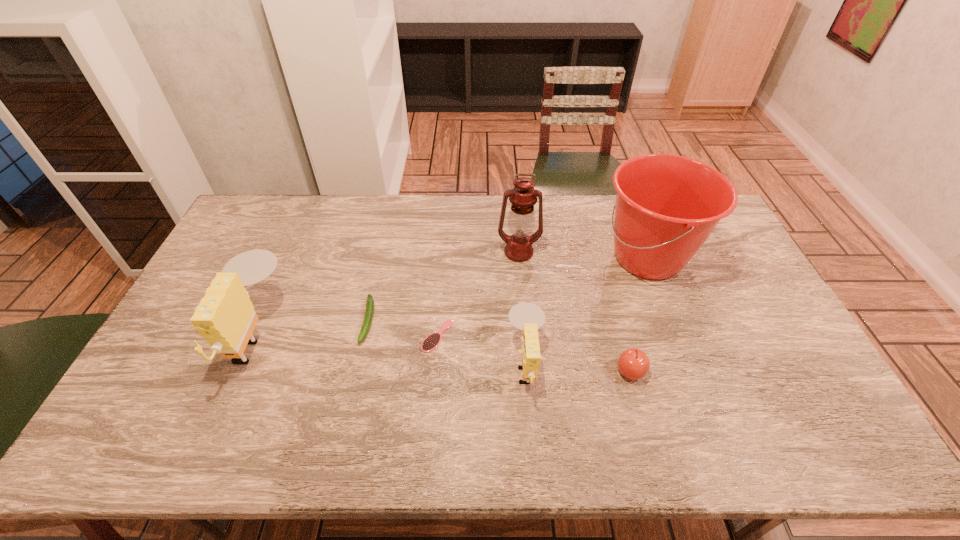
At what (x,y) coordinates should I click in order to perform the action: click on the third shortest object. Please return your answer as a coordinate pair (x, y). Looking at the image, I should click on (634, 364).

Locate an element on the screen. This screenshot has height=540, width=960. free space located on the front-facing side of the leftmost object is located at coordinates (193, 336).

Find the location of a particular element. The height and width of the screenshot is (540, 960). free space located on the front-facing side of the leftmost object is located at coordinates (176, 336).

Locate an element on the screen. Image resolution: width=960 pixels, height=540 pixels. free space located 0.050m on the front-facing side of the leftmost object is located at coordinates (214, 336).

This screenshot has height=540, width=960. I want to click on vacant space situated on the front-facing side of the shorter sponge, so click(x=417, y=364).

The width and height of the screenshot is (960, 540). Find the location of `free region located on the front-facing side of the shorter sponge`. free region located on the front-facing side of the shorter sponge is located at coordinates (435, 364).

The width and height of the screenshot is (960, 540). Find the location of `vacant space situated on the front-facing side of the shorter sponge`. vacant space situated on the front-facing side of the shorter sponge is located at coordinates (442, 364).

This screenshot has width=960, height=540. What are the coordinates of `vacant space situated on the left of the oil lamp` in the screenshot? It's located at (407, 252).

Find the location of a particular element. free space located with the handle attached to the rim of the bucket is located at coordinates (490, 258).

The width and height of the screenshot is (960, 540). Find the location of `free space located 0.150m with the handle attached to the rim of the bucket`. free space located 0.150m with the handle attached to the rim of the bucket is located at coordinates (552, 258).